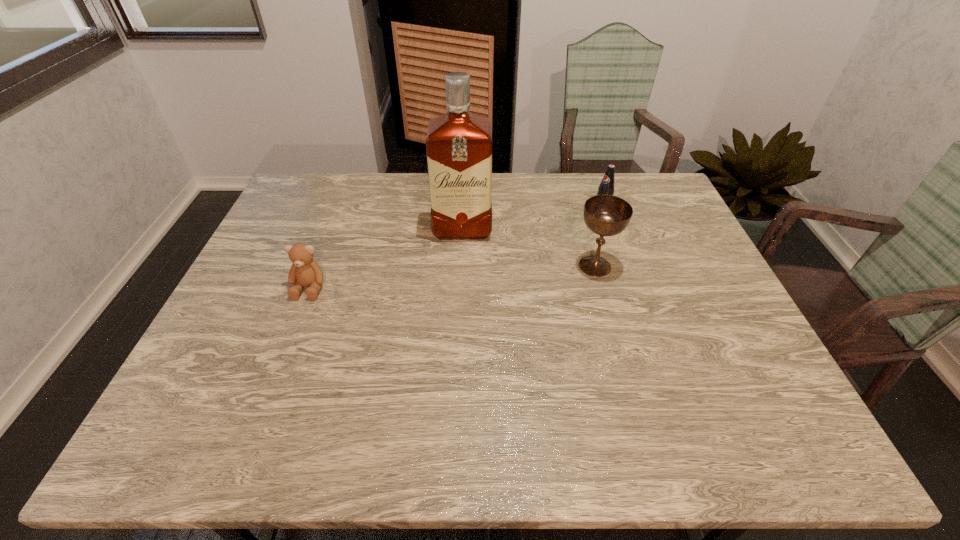
Locate an element on the screen. the shortest object is located at coordinates (305, 272).

Find the location of a particular element. The image size is (960, 540). teddy bear is located at coordinates (305, 272).

Identify the location of chalice. The image size is (960, 540). (606, 215).

Locate an element on the screen. The width and height of the screenshot is (960, 540). the third tallest object is located at coordinates (606, 187).

You are a GUI agent. You are given a task and a screenshot of the screen. Output one action in this format:
    pyautogui.click(x=<x>, y=<y>)
    Task: Click on the farthest object
    
    Given the screenshot: What is the action you would take?
    pyautogui.click(x=606, y=187)

You are a GUI agent. You are given a task and a screenshot of the screen. Output one action in this format:
    pyautogui.click(x=<x>, y=<y>)
    Task: Click on the tallest object
    This screenshot has width=960, height=540.
    Given the screenshot: What is the action you would take?
    pyautogui.click(x=459, y=144)

I want to click on the third object from right to left, so click(459, 144).

This screenshot has width=960, height=540. Find the location of `vacant area located 0.050m on the front-facing side of the teddy bear`. vacant area located 0.050m on the front-facing side of the teddy bear is located at coordinates (299, 316).

You are a GUI agent. You are given a task and a screenshot of the screen. Output one action in this format:
    pyautogui.click(x=<x>, y=<y>)
    Task: Click on the free space located on the left of the chalice
    The image size is (960, 540).
    Given the screenshot: What is the action you would take?
    pyautogui.click(x=527, y=266)

Locate an element on the screen. The image size is (960, 540). free location located on the front label of the second shortest object is located at coordinates coord(524,253).